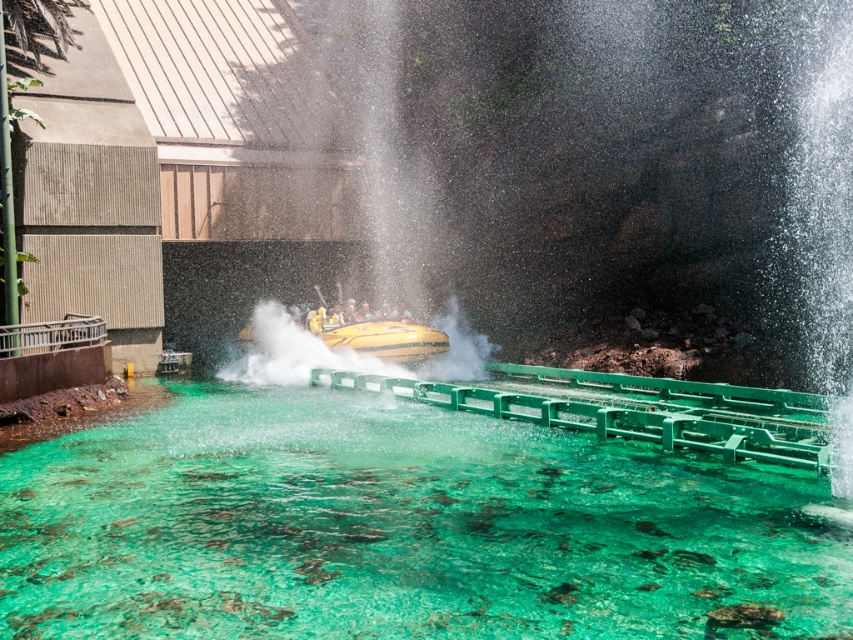
Question: Is translucent green water at center below yellow rubber boat at center?

Choices:
 (A) yes
 (B) no

Answer: (A)

Question: Which of the following is the farthest from the observer?

Choices:
 (A) (387, 358)
 (B) (39, 534)

Answer: (A)

Question: Among these points, which one is farthest from the camera?

Choices:
 (A) (306, 323)
 (B) (419, 349)

Answer: (A)

Question: Is translucent green water at center bigger than yellow rubber boat at center?

Choices:
 (A) no
 (B) yes

Answer: (B)

Question: Is translucent green water at center positioned at the back of yellow matte raft at center?

Choices:
 (A) no
 (B) yes

Answer: (A)

Question: Among these objects, which one is farthest from the camera?

Choices:
 (A) yellow matte raft at center
 (B) translucent green water at center

Answer: (A)